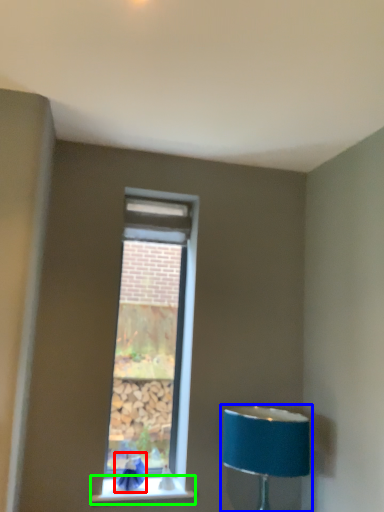
Question: Which object is positioned closest to swivel chair (highlighted by a red box)? Select from lamp (highlighted by a blue box) and window sill (highlighted by a green box).

Choices:
 (A) lamp
 (B) window sill

Answer: (B)